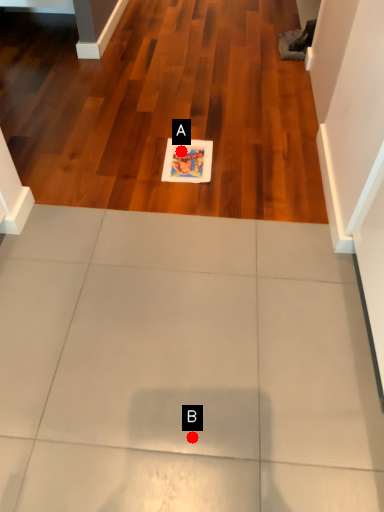
Question: Two points are circled on the image, labeled by A and B beside each circle. Which point is farther from the camera taking this photo?

Choices:
 (A) A is further
 (B) B is further

Answer: (A)